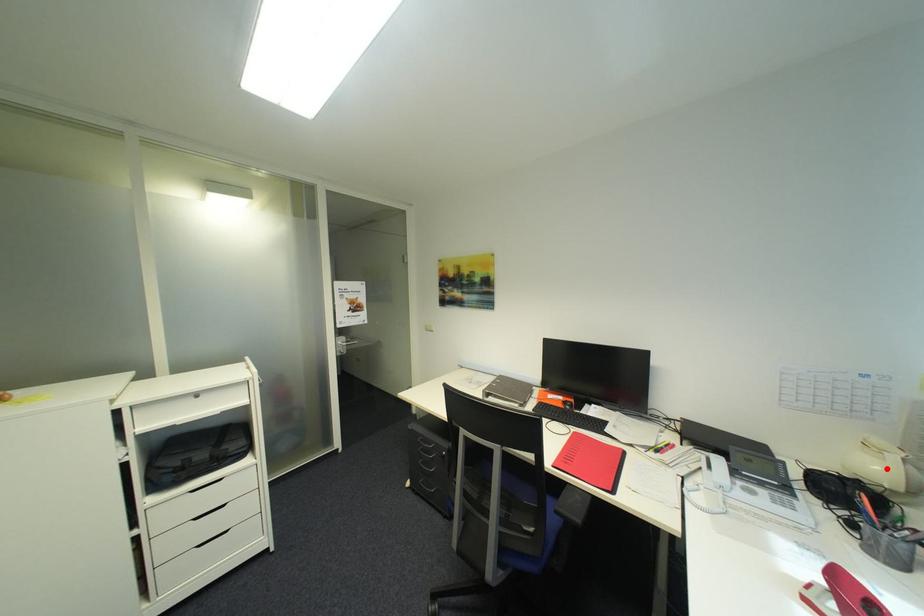
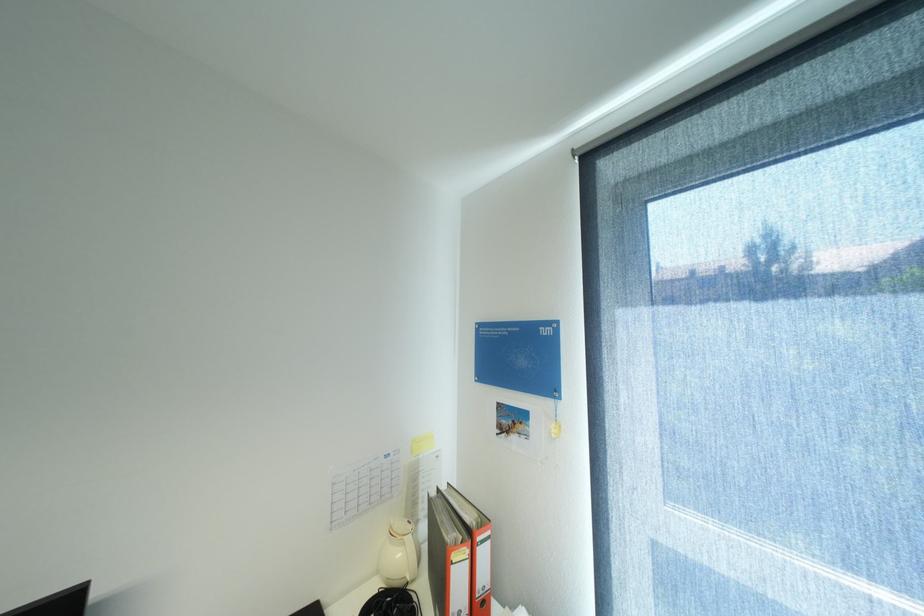
Find the pixel in the second image that matches the highlighted location in the first image.

(407, 554)